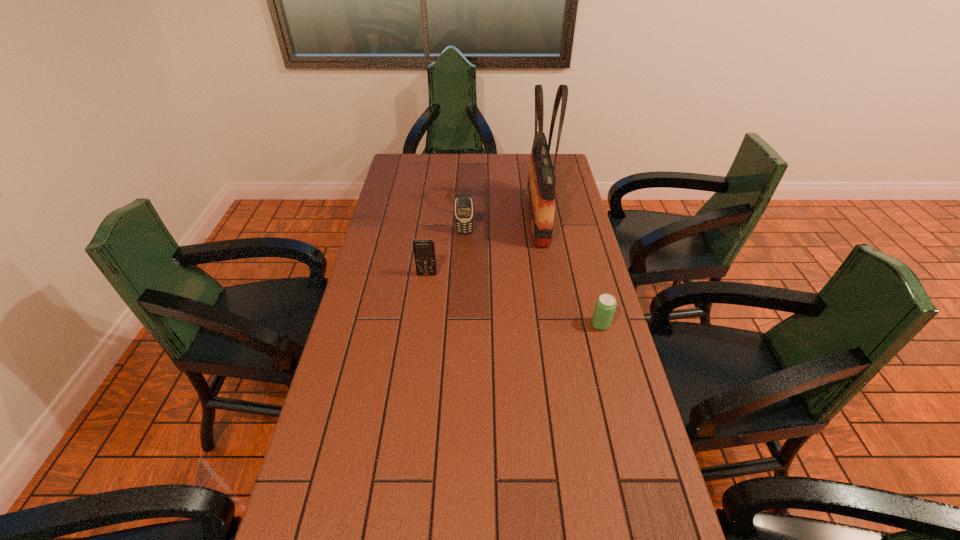
Find the location of a particular element. vacant area that lies between the shopping bag and the shortest object is located at coordinates (569, 271).

You are a GUI agent. You are given a task and a screenshot of the screen. Output one action in this format:
    pyautogui.click(x=<x>, y=<y>)
    Task: Click on the vacant area that lies between the tallest object and the soda
    This screenshot has height=540, width=960.
    Given the screenshot: What is the action you would take?
    pyautogui.click(x=569, y=271)

I want to click on unoccupied area between the second object from right to left and the farther cellular telephone, so click(501, 225).

Identify the location of empty location between the left cellular telephone and the right cellular telephone. The width and height of the screenshot is (960, 540). (445, 253).

Where is `the second closest object to the farther cellular telephone`? Image resolution: width=960 pixels, height=540 pixels. the second closest object to the farther cellular telephone is located at coordinates (424, 250).

Choose which object is the second nearest neighbor to the third object from left to right. Please provide its 2D coordinates. Your answer should be formatted as a tuple, i.e. [(x, y)], where the tuple contains the x and y coordinates of a point satisfying the conditions above.

[(605, 306)]

The image size is (960, 540). Find the location of `free space that satisfies the following two spatial constraints: 1. on the front-facing side of the third object from left to right; 2. on the back side of the soda`. free space that satisfies the following two spatial constraints: 1. on the front-facing side of the third object from left to right; 2. on the back side of the soda is located at coordinates (555, 325).

Where is `vacant space that satisfies the following two spatial constraints: 1. on the front-facing side of the second object from right to left; 2. on the screen of the left cellular telephone`? This screenshot has height=540, width=960. vacant space that satisfies the following two spatial constraints: 1. on the front-facing side of the second object from right to left; 2. on the screen of the left cellular telephone is located at coordinates (547, 274).

The image size is (960, 540). Identify the location of vacant position in the image that satisfies the following two spatial constraints: 1. on the front-facing side of the nearest object; 2. on the right side of the tallest object. (555, 325).

The image size is (960, 540). In order to click on free space in the image that satisfies the following two spatial constraints: 1. on the front-facing side of the rightmost object; 2. on the left side of the shopping bag in this screenshot , I will do `click(555, 325)`.